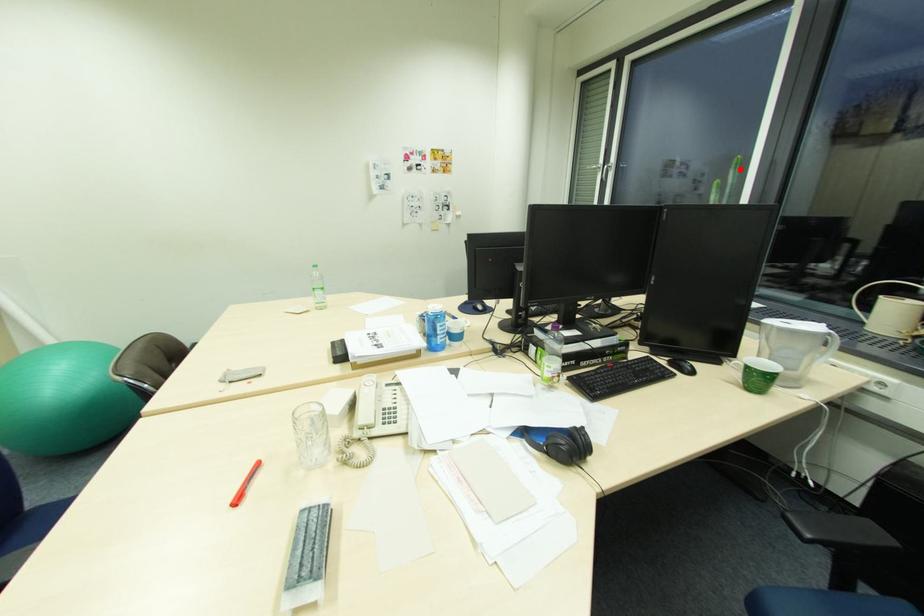
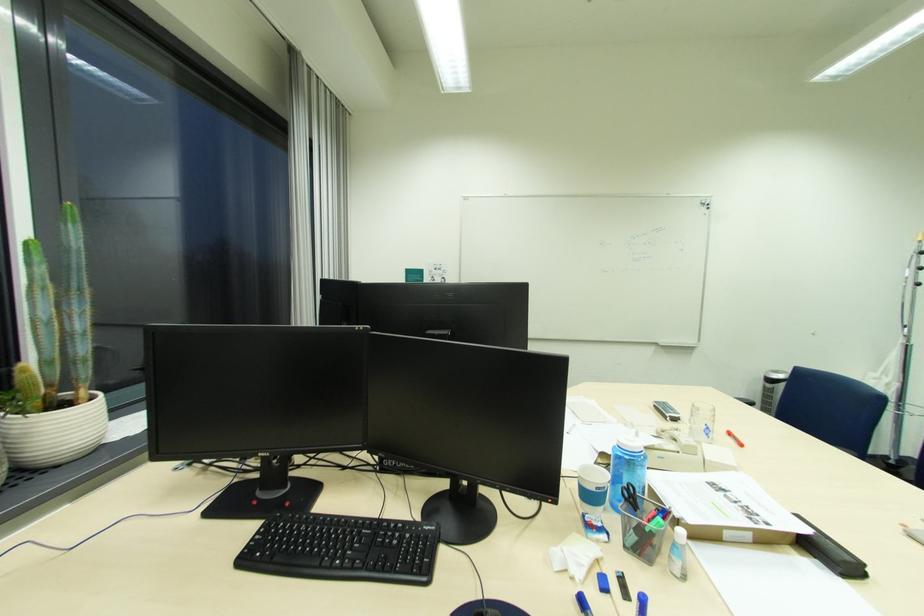
Locate, in the second image, the point that corresponds to the highlighted location in the first image.

(79, 225)